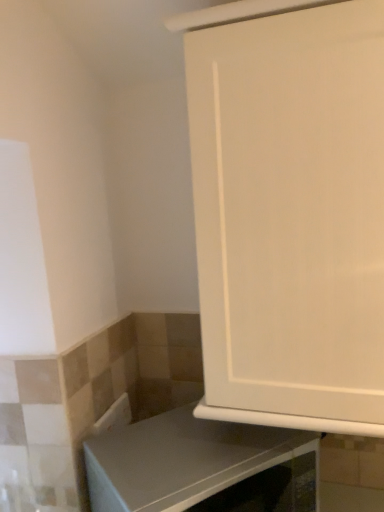
The image size is (384, 512). Identify the location of blank space situated above gray matte countertop at lower center (from a real-world perspective). (181, 446).